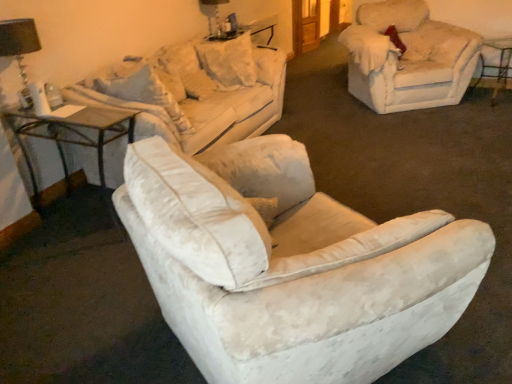
Question: From a real-world perspective, is fuzzy beige chair at upper right positioned over white velvety pillow at upper center, placed as the first pillow when sorted from left to right, based on gravity?

Choices:
 (A) no
 (B) yes

Answer: (A)

Question: Does fuzzy beige chair at upper right have a greater width compared to white velvety pillow at upper center, the 2th pillow from the right?

Choices:
 (A) no
 (B) yes

Answer: (B)

Question: Are fuzzy beige chair at upper right and white velvety pillow at upper center, placed as the first pillow when sorted from left to right, located far from each other?

Choices:
 (A) no
 (B) yes

Answer: (B)

Question: Is fuzzy beige chair at upper right further to the viewer compared to white velvety pillow at upper center, placed as the first pillow when sorted from left to right?

Choices:
 (A) no
 (B) yes

Answer: (B)

Question: Can you confirm if fuzzy beige chair at upper right is bigger than white velvety pillow at upper center, the 2th pillow from the right?

Choices:
 (A) yes
 (B) no

Answer: (A)

Question: In terms of size, does metallic silver bar stool at right appear bigger or smaller than black fabric lampshade at upper left, which is counted as the 2th table lamp, starting from the back?

Choices:
 (A) big
 (B) small

Answer: (A)

Question: Is metallic silver bar stool at right to the left or to the right of black fabric lampshade at upper left, placed as the first table lamp when sorted from left to right, in the image?

Choices:
 (A) left
 (B) right

Answer: (B)

Question: From the image's perspective, relative to black fabric lampshade at upper left, which is counted as the 2th table lamp, starting from the back, is metallic silver bar stool at right above or below?

Choices:
 (A) above
 (B) below

Answer: (A)

Question: Is point (476, 82) positioned closer to the camera than point (10, 29)?

Choices:
 (A) farther
 (B) closer

Answer: (A)

Question: From the image's perspective, is matte black table lamp at upper center, which ranks as the first table lamp in right-to-left order, above or below wooden glass table at left?

Choices:
 (A) above
 (B) below

Answer: (A)

Question: Is point (210, 31) positioned closer to the camera than point (101, 117)?

Choices:
 (A) closer
 (B) farther

Answer: (B)

Question: In the image, is matte black table lamp at upper center, the 1th table lamp viewed from the back, on the left side or the right side of wooden glass table at left?

Choices:
 (A) right
 (B) left

Answer: (A)

Question: Is matte black table lamp at upper center, positioned as the 1th table lamp in top-to-bottom order, taller or shorter than wooden glass table at left?

Choices:
 (A) tall
 (B) short

Answer: (B)

Question: Looking at their shapes, would you say black fabric lampshade at upper left, which is counted as the 2th table lamp, starting from the back, is wider or thinner than fuzzy beige chair at upper right?

Choices:
 (A) wide
 (B) thin

Answer: (B)

Question: Is black fabric lampshade at upper left, the 2th table lamp when ordered from right to left, taller or shorter than fuzzy beige chair at upper right?

Choices:
 (A) short
 (B) tall

Answer: (A)